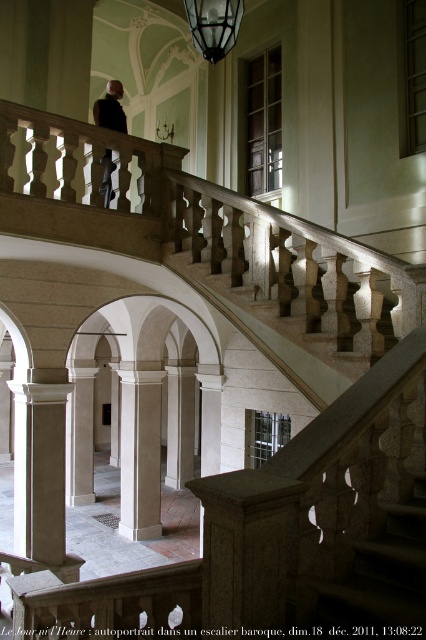
Does point (189, 17) lie behind point (118, 120)?

No, it is not.

Can you confirm if matte glass lamp at upper center is wider than dark gray suit at upper center?

Incorrect, matte glass lamp at upper center's width does not surpass dark gray suit at upper center's.

The width and height of the screenshot is (426, 640). What do you see at coordinates (213, 26) in the screenshot?
I see `matte glass lamp at upper center` at bounding box center [213, 26].

The width and height of the screenshot is (426, 640). Identify the location of matte glass lamp at upper center. (213, 26).

Who is positioned more to the right, white stone column at center or matte glass lamp at upper center?

Positioned to the right is matte glass lamp at upper center.

Which is in front, point (141, 506) or point (221, 17)?

Positioned in front is point (221, 17).

You are a GUI agent. You are given a task and a screenshot of the screen. Output one action in this format:
    pyautogui.click(x=<x>, y=<y>)
    Task: Click on the white stone column at center
    
    Given the screenshot: What is the action you would take?
    pyautogui.click(x=140, y=452)

Measure the distance from white stone column at center to dark gray suit at upper center.

A distance of 5.18 meters exists between white stone column at center and dark gray suit at upper center.

Does point (137, 410) come in front of point (101, 116)?

No, it is not.

Where is `white stone column at center`? The width and height of the screenshot is (426, 640). white stone column at center is located at coordinates (140, 452).

This screenshot has width=426, height=640. What are the coordinates of `white stone column at center` in the screenshot? It's located at pyautogui.click(x=140, y=452).